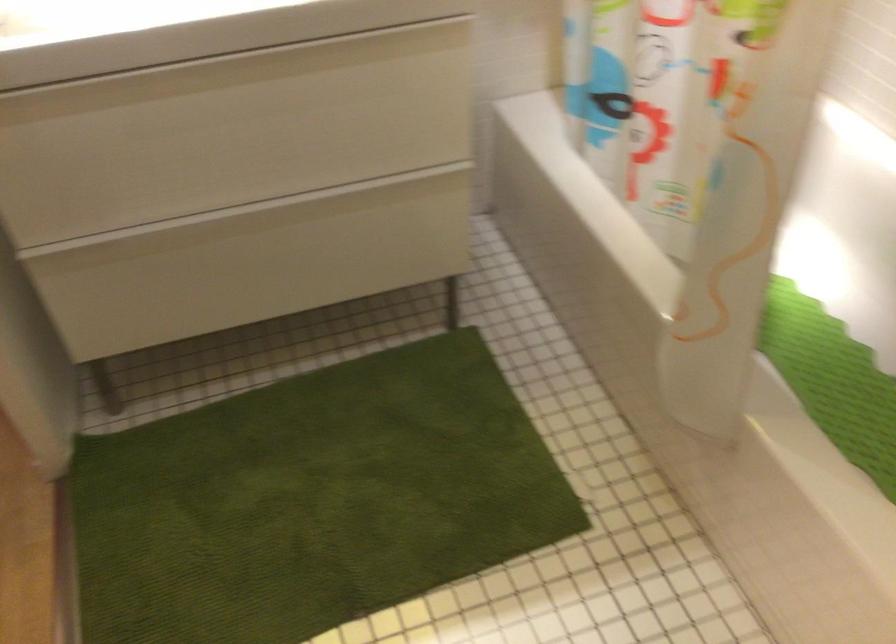
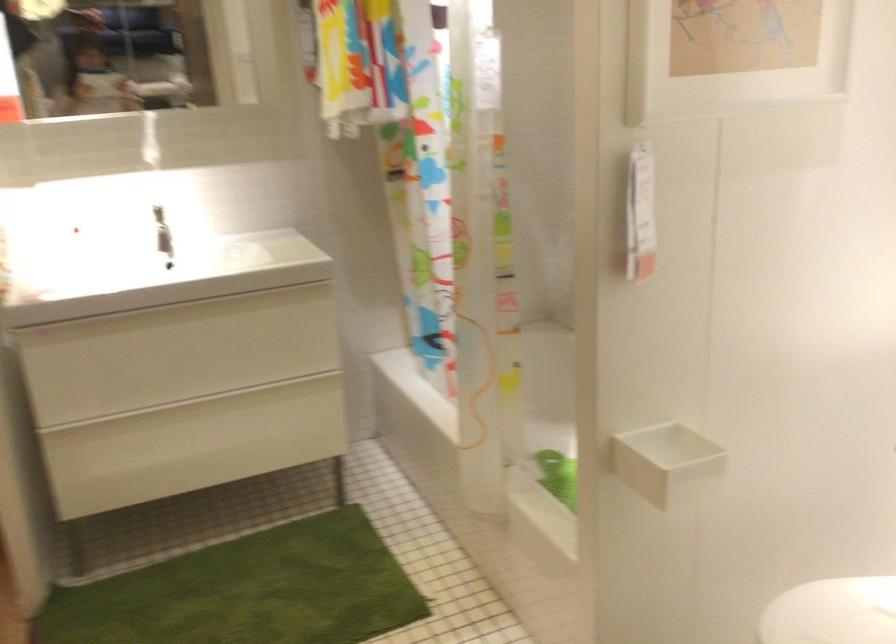
In the second image, find the point that corresponds to point 700,161 in the first image.

(492, 366)